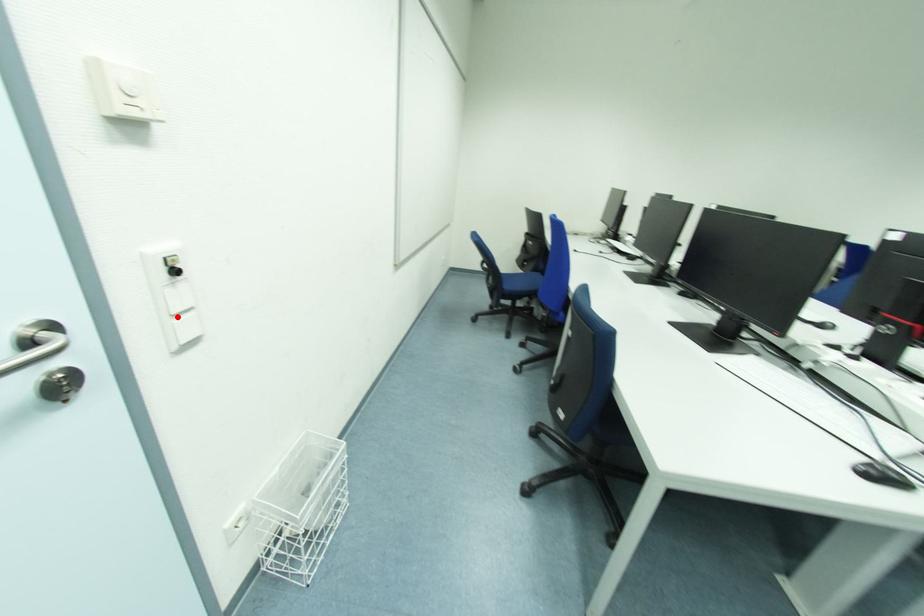
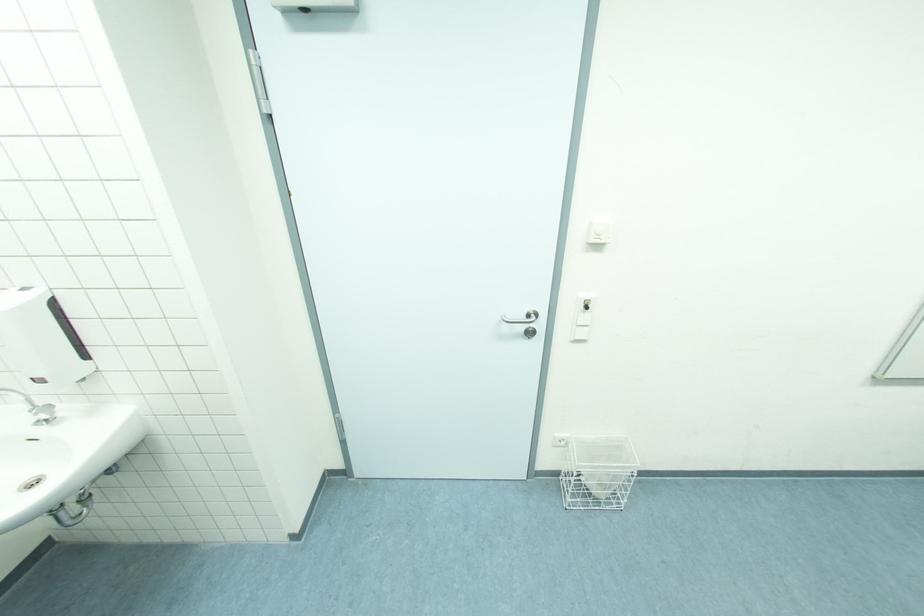
The point at the highlighted location is marked in the first image. Where is the corresponding point in the second image?

(580, 328)